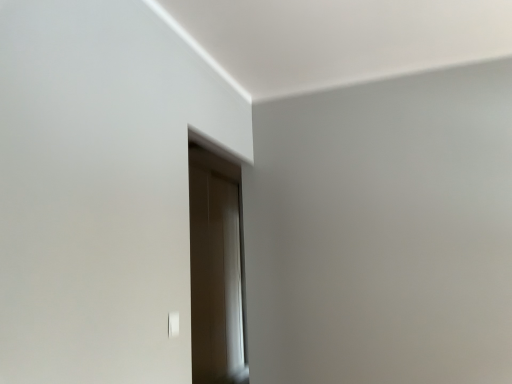
Identify the location of white plastic light switch at lower left. This screenshot has height=384, width=512. (173, 324).

The width and height of the screenshot is (512, 384). What do you see at coordinates (173, 324) in the screenshot? I see `white plastic light switch at lower left` at bounding box center [173, 324].

This screenshot has height=384, width=512. I want to click on white plastic light switch at lower left, so [173, 324].